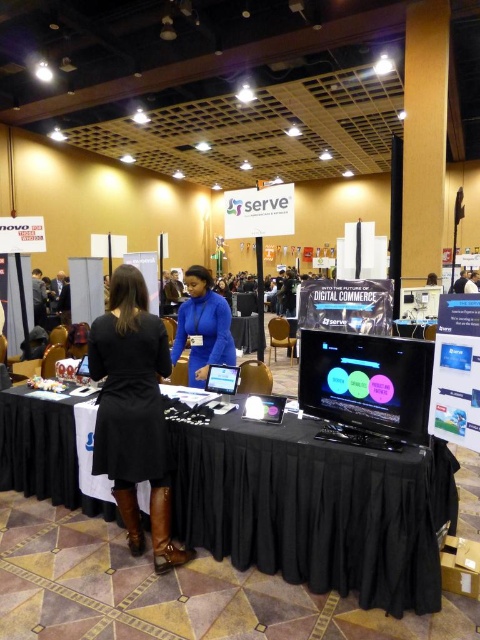
Question: Does black fabric table at center come behind matte black monitor at center?

Choices:
 (A) yes
 (B) no

Answer: (B)

Question: Is blue matte jacket at center positioned at the back of black glossy table at center?

Choices:
 (A) yes
 (B) no

Answer: (B)

Question: Can you confirm if black fabric table at center is positioned below matte black dress at center?

Choices:
 (A) yes
 (B) no

Answer: (A)

Question: Among these points, which one is nearest to the camera?

Choices:
 (A) (202, 492)
 (B) (153, 472)
 (C) (233, 348)
 (D) (365, 403)

Answer: (D)

Question: Which point appears closest to the camera in this image?

Choices:
 (A) (210, 321)
 (B) (404, 326)
 (C) (370, 397)

Answer: (C)

Question: Which object is the closest to the black fabric table at center?

Choices:
 (A) matte black monitor at center
 (B) black glossy table at center
 (C) matte black dress at center
 (D) blue matte jacket at center

Answer: (A)